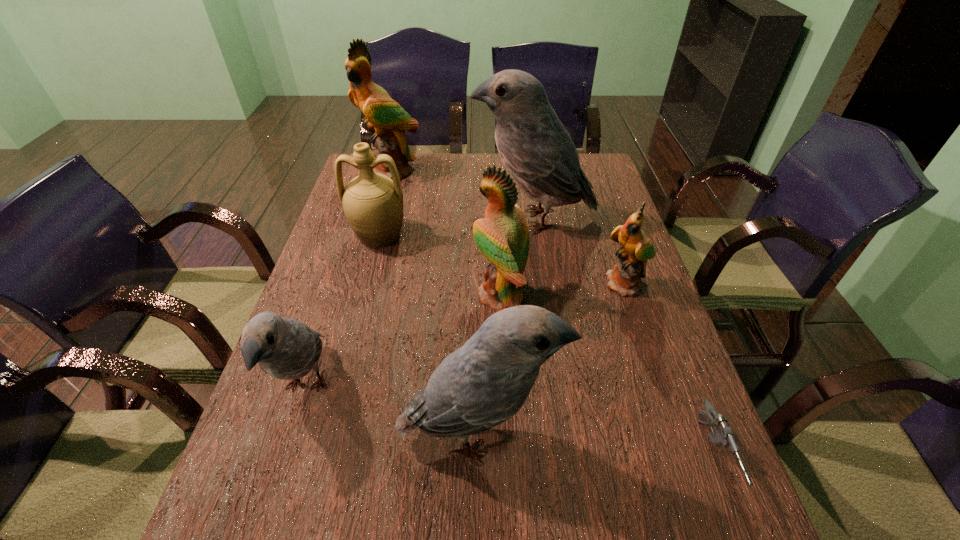
At what (x,y) coordinates should I click in order to perform the action: click on free spot located on the front-facing side of the smallest gray parrot. Please return your answer as a coordinate pair (x, y). The height and width of the screenshot is (540, 960). Looking at the image, I should click on (273, 492).

Locate an element on the screen. Image resolution: width=960 pixels, height=540 pixels. object that is at the far edge is located at coordinates (x=384, y=117).

This screenshot has width=960, height=540. In order to click on pitcher that is at the left edge in this screenshot , I will do `click(373, 203)`.

Identify the location of gun at the right edge. Image resolution: width=960 pixels, height=540 pixels. (723, 436).

At what (x,y) coordinates should I click in order to perform the action: click on object situated at the far left corner. Please return your answer as a coordinate pair (x, y). The height and width of the screenshot is (540, 960). Looking at the image, I should click on (384, 117).

Where is `vacant space at the far edge of the desktop`? The width and height of the screenshot is (960, 540). vacant space at the far edge of the desktop is located at coordinates (406, 176).

You are a GUI agent. You are given a task and a screenshot of the screen. Output one action in this format:
    pyautogui.click(x=<x>, y=<y>)
    Task: Click on the vacant space at the left edge of the desktop
    The image size is (960, 540).
    Given the screenshot: What is the action you would take?
    pyautogui.click(x=256, y=465)

Image resolution: width=960 pixels, height=540 pixels. Identify the location of vacant point at the right edge. (575, 211).

This screenshot has width=960, height=540. Find the location of `free point at the far right corner`. free point at the far right corner is located at coordinates (586, 157).

Find the location of a particular element. free space that is in between the second farthest parrot and the shortest object is located at coordinates tap(623, 338).